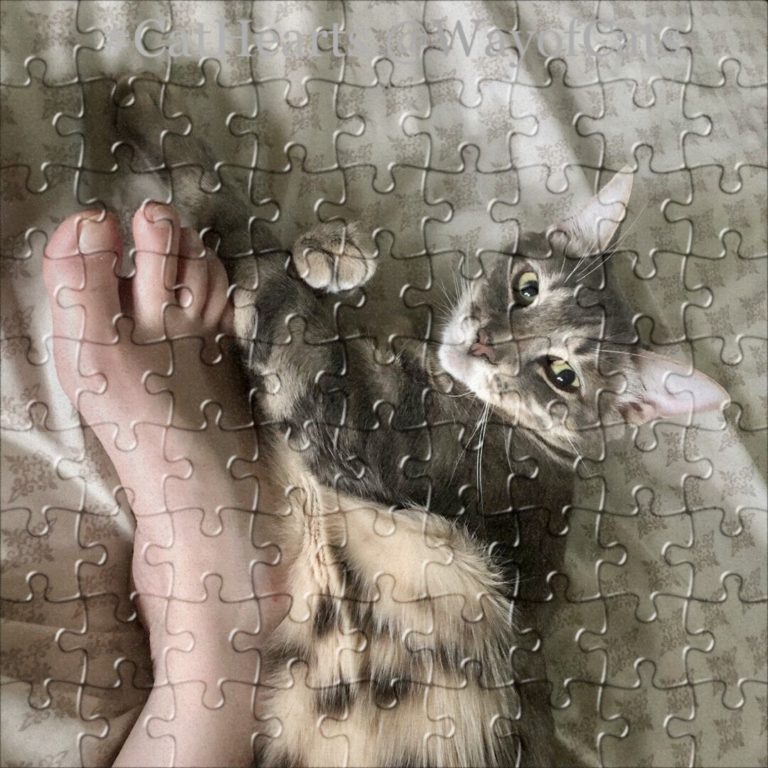
You are a GUI agent. You are given a task and a screenshot of the screen. Output one action in this format:
    pyautogui.click(x=<x>, y=<y>)
    Task: Click on the corner pieces
    
    Given the screenshot: What is the action you would take?
    pyautogui.click(x=730, y=740), pyautogui.click(x=28, y=732), pyautogui.click(x=733, y=37), pyautogui.click(x=27, y=22)